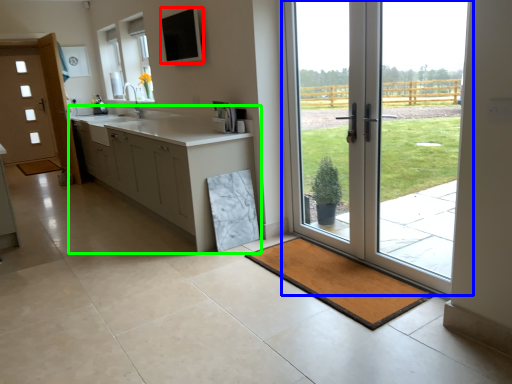
Question: Which object is the closest to the window screen (highlighted by a red box)? Choose among these: door (highlighted by a blue box) or cabinetry (highlighted by a green box).

Choices:
 (A) door
 (B) cabinetry

Answer: (B)